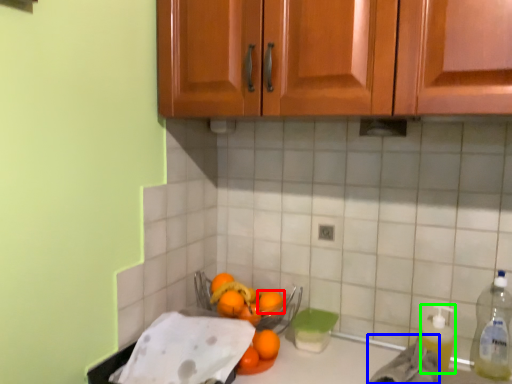
Question: Estimate the real-world distances between objects in this image. Which object is closer to orange (highlighted by a red box), material (highlighted by a blue box) or cleaning product (highlighted by a green box)?

Choices:
 (A) material
 (B) cleaning product

Answer: (A)